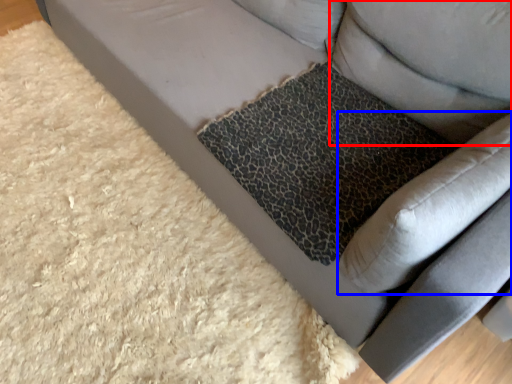
Question: Which object appears closest to the camera in this image, pillow (highlighted by a red box) or swivel chair (highlighted by a blue box)?

Choices:
 (A) pillow
 (B) swivel chair

Answer: (B)